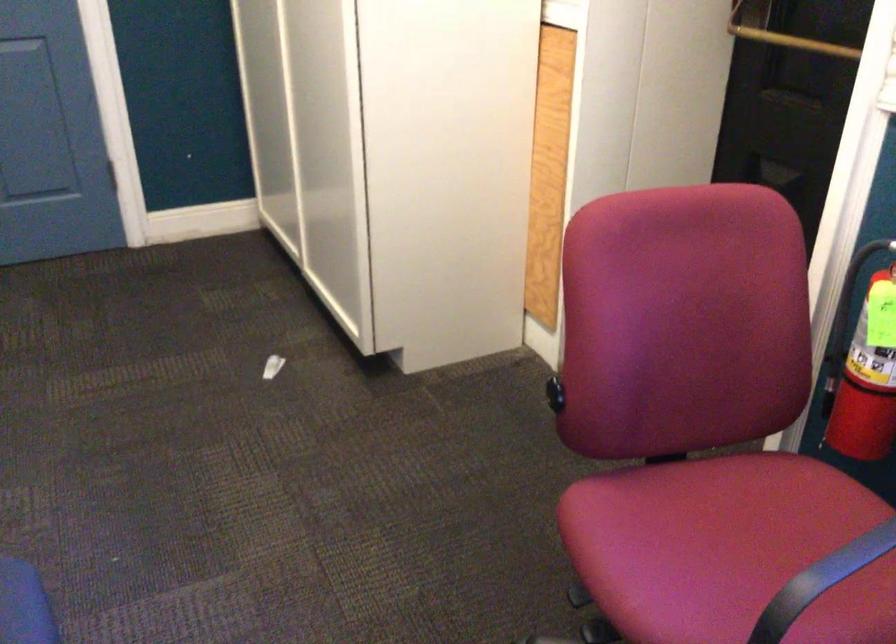
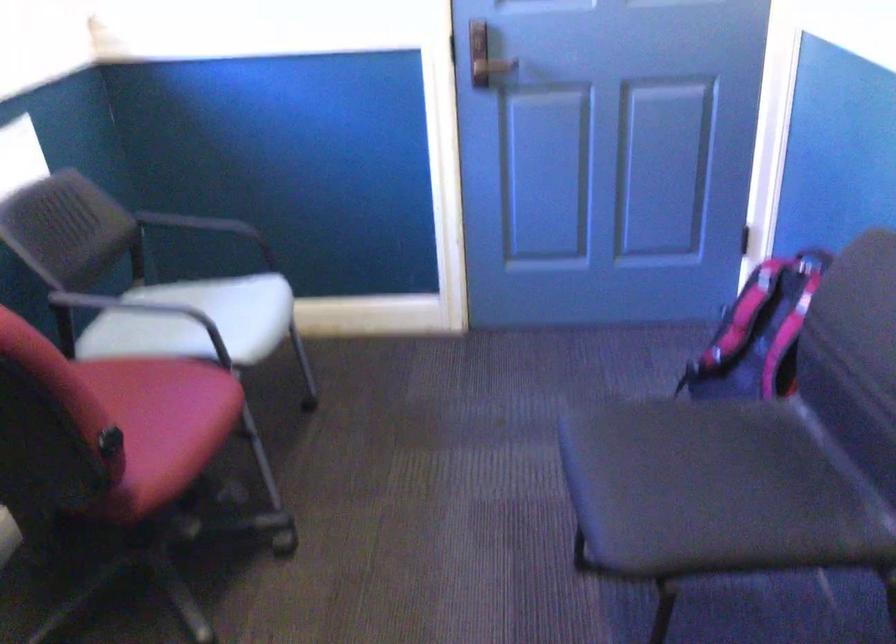
In the second image, find the point that corresponds to [717,562] in the first image.

(149, 402)